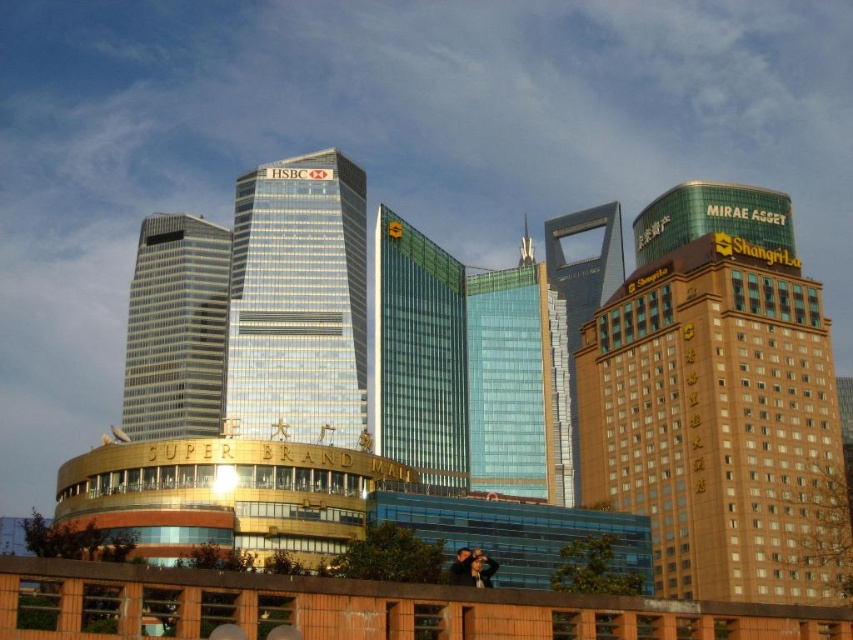
Question: Which point is closer to the camera?

Choices:
 (A) silver glass skyscraper at center
 (B) brown brick hotel at right
 (C) green glass skyscraper at center

Answer: (B)

Question: Among these objects, which one is farthest from the camera?

Choices:
 (A) glassy metallic skyscraper at center
 (B) glassy skyscraper at center
 (C) green glass skyscraper at center

Answer: (B)

Question: Does brown brick hotel at right appear on the right side of green glass skyscraper at center?

Choices:
 (A) yes
 (B) no

Answer: (A)

Question: Does silver glass skyscraper at center have a lesser width compared to glassy skyscraper at center?

Choices:
 (A) yes
 (B) no

Answer: (B)

Question: Which of the following is the closest to the observer?

Choices:
 (A) (706, 337)
 (B) (477, 285)
 (C) (177, 436)

Answer: (A)

Question: Can you confirm if brown brick hotel at right is thinner than green glass skyscraper at center?

Choices:
 (A) no
 (B) yes

Answer: (A)